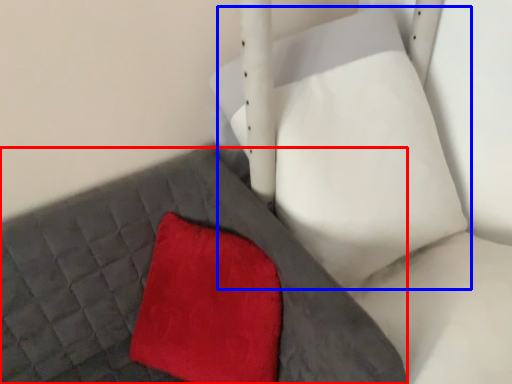
Question: Which object is closer to the camera taking this photo, bed frame (highlighted by a red box) or bean bag chair (highlighted by a blue box)?

Choices:
 (A) bed frame
 (B) bean bag chair

Answer: (B)